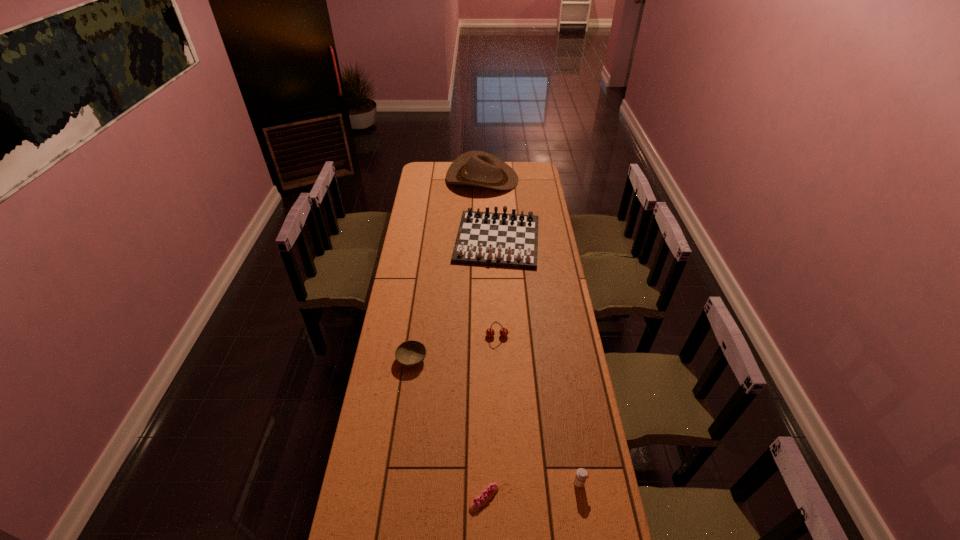
The width and height of the screenshot is (960, 540). I want to click on vacant space in between the third nearest object and the medicine, so click(495, 421).

What are the coordinates of `vacant area that lies between the bowl and the eclair` in the screenshot? It's located at (448, 429).

The height and width of the screenshot is (540, 960). Identify the location of free space between the third nearest object and the shortest object. (448, 429).

This screenshot has width=960, height=540. In order to click on empty space that is in between the shortest object and the tallest object in this screenshot , I will do `click(483, 339)`.

Image resolution: width=960 pixels, height=540 pixels. Find the location of `free space between the second farthest object and the cherry`. free space between the second farthest object and the cherry is located at coordinates (497, 288).

Identify the location of object that stands as the third closest to the medicine. (410, 353).

The height and width of the screenshot is (540, 960). I want to click on object that stands as the closest to the medicine, so click(x=486, y=494).

The height and width of the screenshot is (540, 960). Identify the location of free location that satisfies the following two spatial constraints: 1. with a star on the front of the fifth nearest object; 2. on the right side of the cowboy hat. (483, 240).

Identify the location of vacant space that satisfies the following two spatial constraints: 1. on the back side of the shortest object; 2. on the left side of the fifth nearest object. (483, 240).

Find the location of a particular element. free point that satisfies the following two spatial constraints: 1. with a star on the front of the farthest object; 2. on the back side of the fifth nearest object is located at coordinates (483, 240).